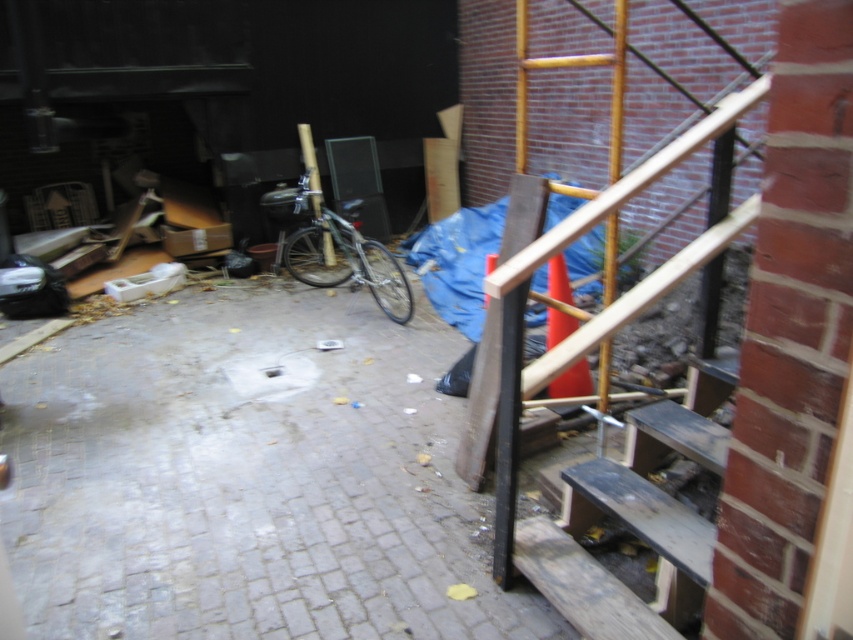
You are a delivery person who needs to place a large box that is 1.2 meters tall. You see the wooden at right and the dark brown wooden stairs at lower right. Which object can safely support the box without it toppling over?

The wooden at right is taller than the dark brown wooden stairs at lower right, so the wooden at right can safely support the box without it toppling over.

You are a delivery person who needs to place a large package on the ground. The package is the size of the shiny metallic bicycle at center. There is a space where the wooden at right is currently located. Will the package fit in that space?

The wooden at right is smaller than the shiny metallic bicycle at center, so the space where the wooden at right is located may not be large enough to accommodate the package, which is the size of the shiny metallic bicycle at center. The package might not fit.

You are standing at the point labeled as point (595,220) in the image. Looking around, you see a wooden post with a bicycle leaning against it. Which direction should you walk to reach the wooden post with the bicycle?

The point (595,220) is on wooden at right. Since the wooden post with the bicycle is located at center left, you should walk to the left to reach it.